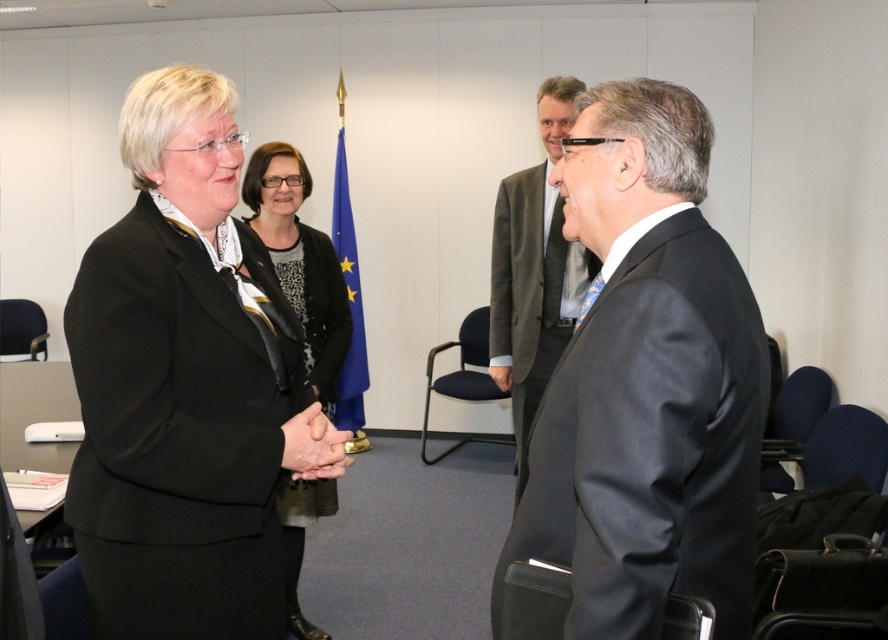
Question: Is blue fabric flag at center further to camera compared to smooth skin handshake at center?

Choices:
 (A) yes
 (B) no

Answer: (A)

Question: Does black leather jacket at center lie in front of smooth skin handshake at center?

Choices:
 (A) no
 (B) yes

Answer: (A)

Question: Estimate the real-world distances between objects in this image. Which object is farther from the black matte suit at center?

Choices:
 (A) black leather jacket at center
 (B) black suit at center
 (C) smooth skin handshake at center

Answer: (A)

Question: Which of these objects is positioned closest to the dark gray suit at center?

Choices:
 (A) black leather jacket at center
 (B) smooth skin handshake at center

Answer: (A)

Question: Can you confirm if black matte suit at center is smaller than black leather jacket at center?

Choices:
 (A) yes
 (B) no

Answer: (A)

Question: Which of the following is the farthest from the observer?

Choices:
 (A) black leather jacket at center
 (B) smooth skin handshake at center

Answer: (A)